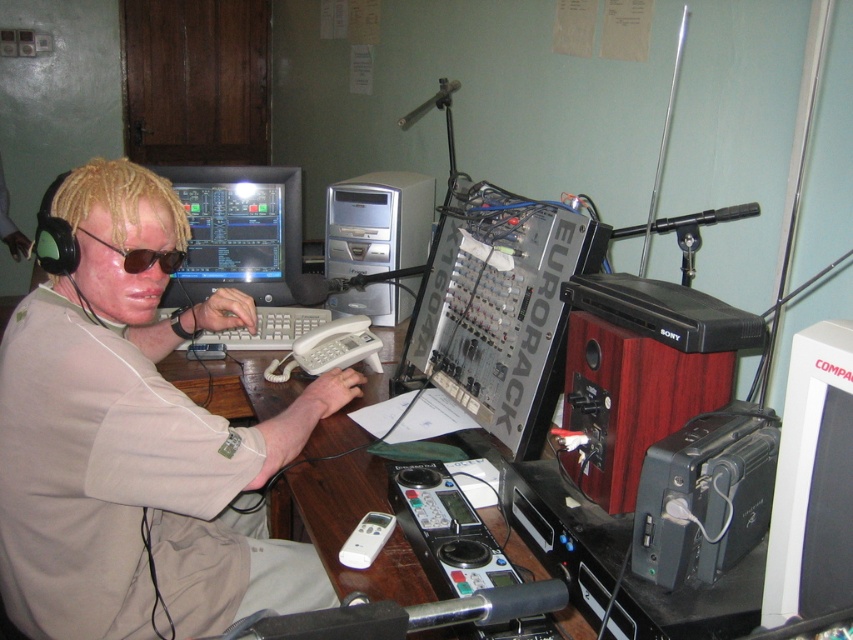
Question: Which object is the farthest from the white plastic monitor at right?

Choices:
 (A) black matte sunglasses at left
 (B) wooden/maroon speaker at right

Answer: (A)

Question: Among these points, which one is nearest to the camera?

Choices:
 (A) (811, 358)
 (B) (585, 362)
 (C) (164, 465)

Answer: (A)

Question: Considering the real-world distances, which object is farthest from the matte beige shirt at center?

Choices:
 (A) black matte sunglasses at left
 (B) wooden/maroon speaker at right
 (C) matte black monitor at center

Answer: (C)

Question: Can you confirm if matte beige shirt at center is positioned to the left of black matte sunglasses at left?

Choices:
 (A) yes
 (B) no

Answer: (B)

Question: Can you confirm if matte beige shirt at center is positioned below black matte sunglasses at left?

Choices:
 (A) no
 (B) yes

Answer: (B)

Question: Does wooden/maroon speaker at right appear on the left side of matte black monitor at center?

Choices:
 (A) no
 (B) yes

Answer: (A)